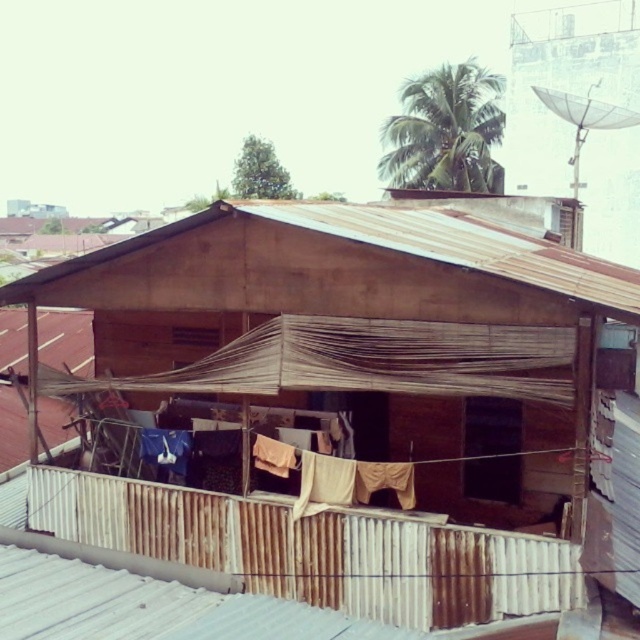
Question: Among these objects, which one is nearest to the camera?

Choices:
 (A) brown corrugated metal hut at center
 (B) brown corrugated metal roof at center

Answer: (B)

Question: Can you confirm if brown corrugated metal hut at center is thinner than brown corrugated metal roof at center?

Choices:
 (A) no
 (B) yes

Answer: (A)

Question: Which point is farther to the camera?

Choices:
 (A) brown corrugated metal roof at center
 (B) brown corrugated metal hut at center

Answer: (B)

Question: Does brown corrugated metal hut at center appear on the right side of brown corrugated metal roof at center?

Choices:
 (A) yes
 (B) no

Answer: (B)

Question: Does brown corrugated metal hut at center have a lesser width compared to brown corrugated metal roof at center?

Choices:
 (A) yes
 (B) no

Answer: (B)

Question: Which point is farther to the camera?

Choices:
 (A) (328, 220)
 (B) (369, 234)

Answer: (A)